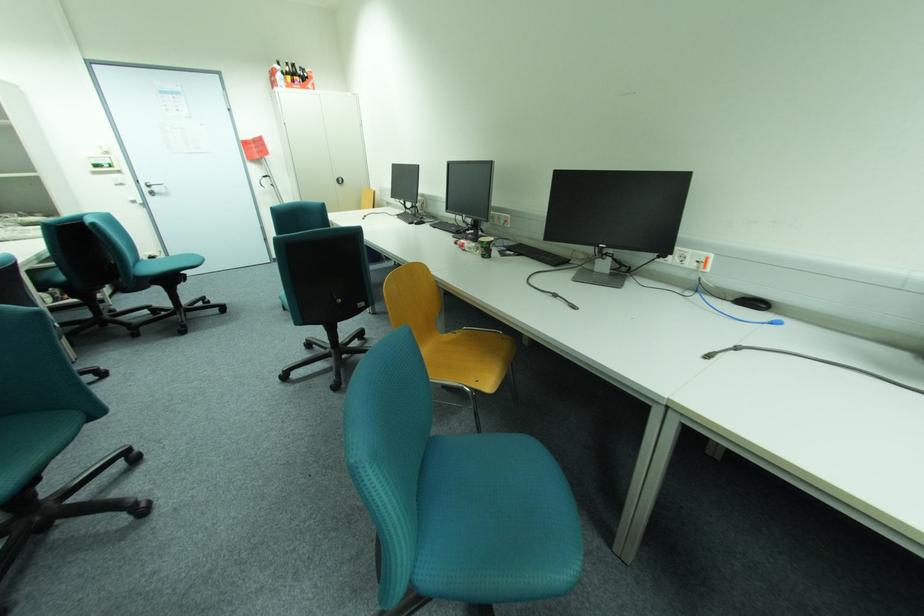
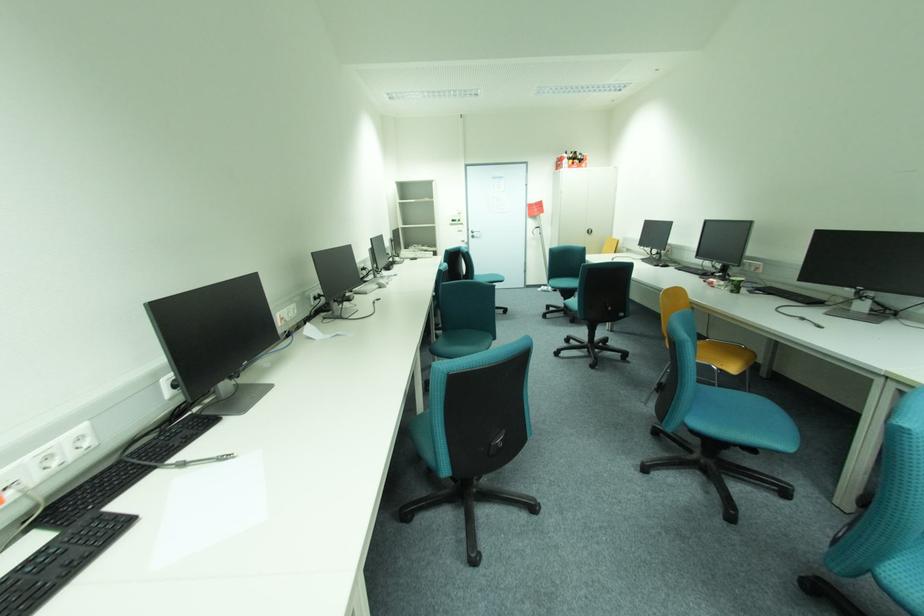
Where in the second image is the point corresponding to point 490,256 from the first image?

(738, 292)